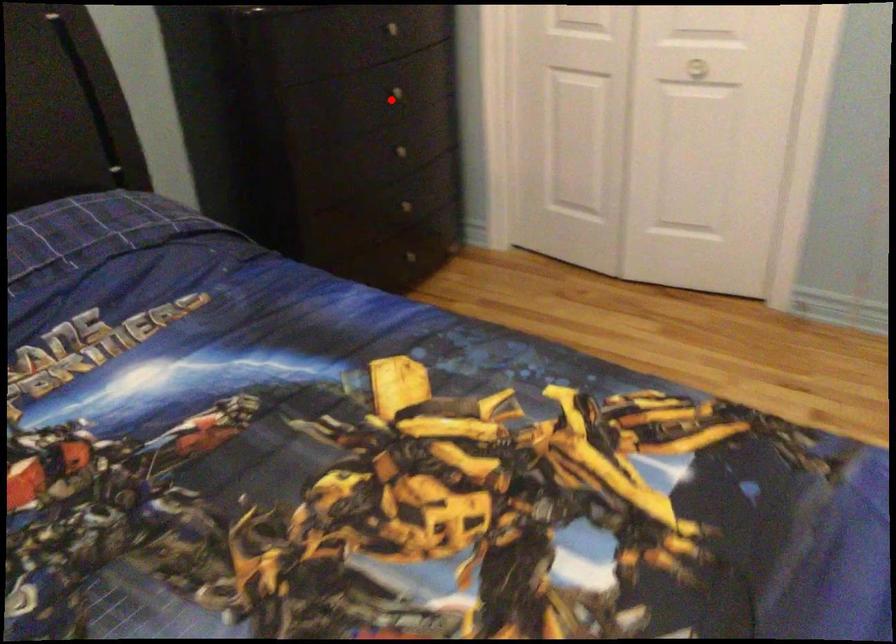
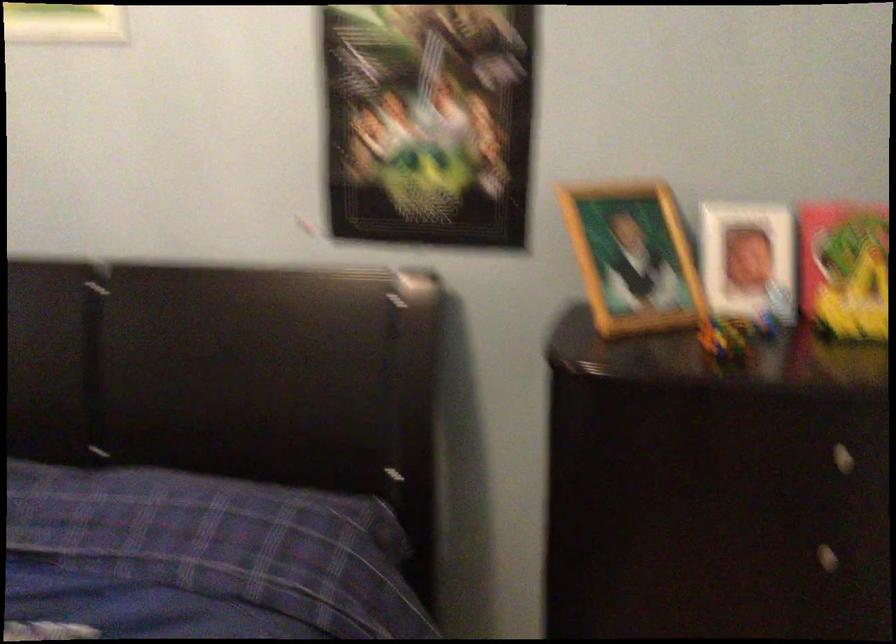
Locate, in the second image, the point that corresponds to the highlighted location in the first image.

(807, 554)